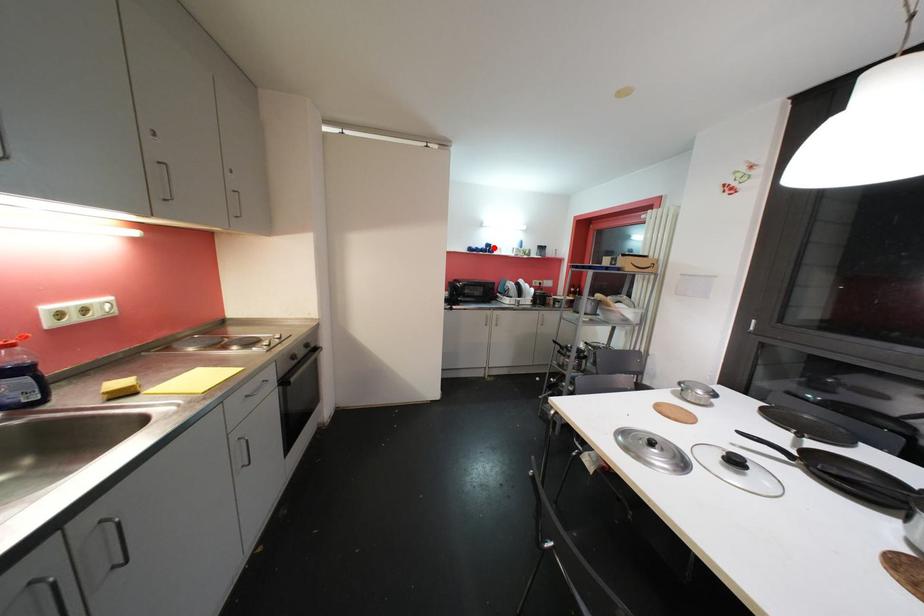
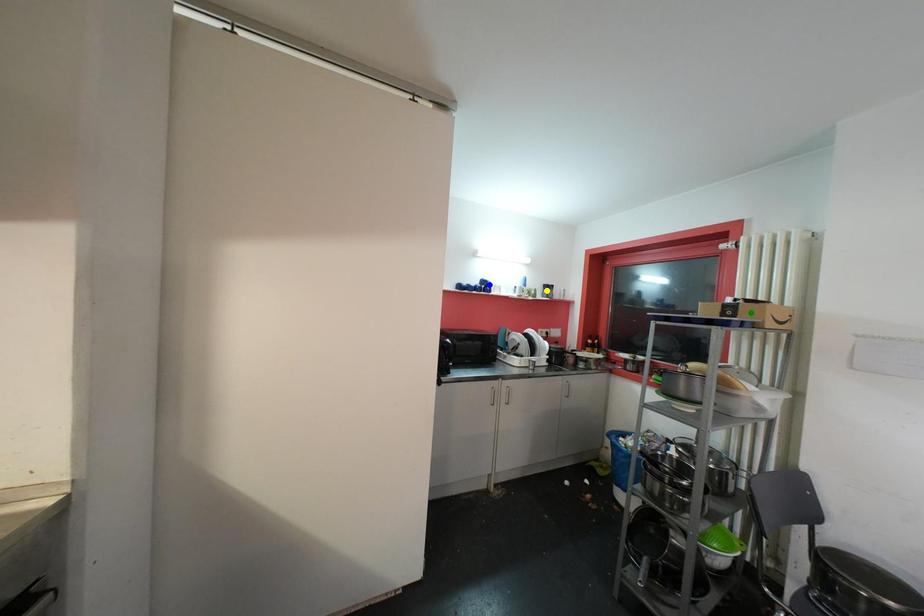
Question: I am providing you with two images of the same scene from different viewpoints. A red point is marked on the first image. You are given multiple points on the second image. Which point in image 2 is actually the same real-world point as the red point in image 1?

Choices:
 (A) blue point
 (B) yellow point
 (C) green point

Answer: (A)